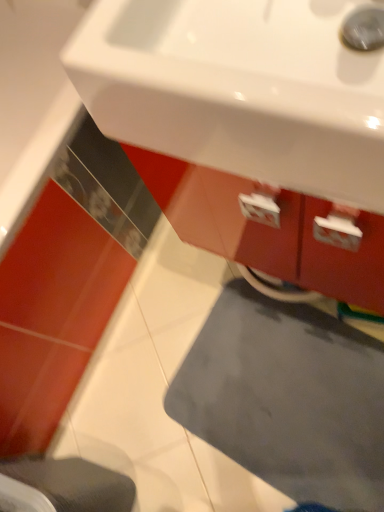
Question: Is gray matte bath mat at lower center bigger or smaller than white glossy sink at upper center?

Choices:
 (A) small
 (B) big

Answer: (A)

Question: Is point (347, 483) closer or farther from the camera than point (339, 47)?

Choices:
 (A) farther
 (B) closer

Answer: (A)

Question: Which of these objects is positioned farthest from the white glossy sink at upper center?

Choices:
 (A) gray matte bath mat at lower center
 (B) gray fabric step stool at lower left

Answer: (A)

Question: Based on their relative distances, which object is nearer to the white glossy sink at upper center?

Choices:
 (A) gray fabric step stool at lower left
 (B) gray matte bath mat at lower center

Answer: (A)